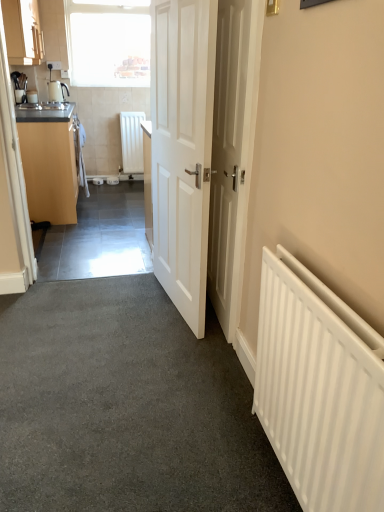
Question: Considering their positions, is matte wood cabinet at upper left, positioned as the 2th cabinetry in bottom-to-top order, located in front of or behind transparent glass window at upper left?

Choices:
 (A) front
 (B) behind

Answer: (A)

Question: From a real-world perspective, is matte wood cabinet at upper left, positioned as the 2th cabinetry in bottom-to-top order, positioned above or below transparent glass window at upper left?

Choices:
 (A) below
 (B) above

Answer: (B)

Question: Considering the real-world distances, which object is closest to the matte wood cabinet at left, acting as the 1th cabinetry starting from the bottom?

Choices:
 (A) matte black sink at left
 (B) white matte door at center, which is the first door in right-to-left order
 (C) transparent glass window at upper left
 (D) white matte radiator at right, placed as the first radiator when sorted from front to back
 (E) matte wood cabinet at upper left, which is the first cabinetry from top to bottom

Answer: (A)

Question: Considering the real-world distances, which object is farthest from the matte wood cabinet at upper left, positioned as the 2th cabinetry in bottom-to-top order?

Choices:
 (A) matte black sink at left
 (B) white matte door at center, which is the first door in right-to-left order
 (C) transparent glass window at upper left
 (D) white wooden door at center, which is the 1th door in left-to-right order
 (E) matte wood cabinet at left, acting as the 1th cabinetry starting from the bottom

Answer: (B)